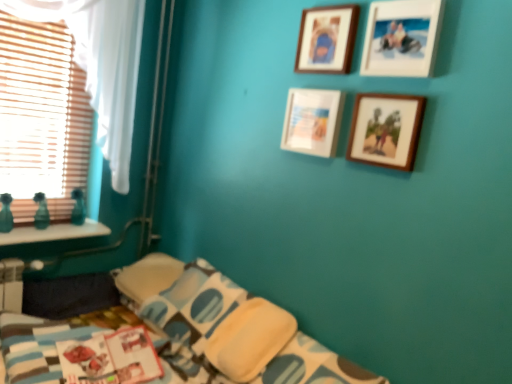
Question: Is wooden photo frame at upper right, the 1th picture frame positioned from the bottom, placed right next to wooden photo frame at upper right, the second picture frame viewed from the top?

Choices:
 (A) yes
 (B) no

Answer: (B)

Question: Can you confirm if wooden photo frame at upper right, the 1th picture frame positioned from the bottom, is positioned to the left of wooden photo frame at upper right, which is counted as the third picture frame, starting from the bottom?

Choices:
 (A) no
 (B) yes

Answer: (B)

Question: Is wooden photo frame at upper right, the 1th picture frame positioned from the bottom, aimed at wooden photo frame at upper right, which is counted as the third picture frame, starting from the bottom?

Choices:
 (A) no
 (B) yes

Answer: (A)

Question: Can you confirm if wooden photo frame at upper right, the 1th picture frame positioned from the bottom, is wider than wooden photo frame at upper right, the second picture frame viewed from the top?

Choices:
 (A) yes
 (B) no

Answer: (B)

Question: From the image's perspective, does wooden photo frame at upper right, the 1th picture frame positioned from the bottom, appear lower than wooden photo frame at upper right, the second picture frame viewed from the top?

Choices:
 (A) yes
 (B) no

Answer: (A)

Question: Does point (378, 165) appear closer or farther from the camera than point (330, 44)?

Choices:
 (A) closer
 (B) farther

Answer: (A)

Question: Choose the correct answer: Is wooden photo frame at upper right, which ranks as the 4th picture frame in top-to-bottom order, inside wooden picture frame at upper center, which is the first picture frame from top to bottom, or outside it?

Choices:
 (A) outside
 (B) inside

Answer: (A)

Question: From the image's perspective, is wooden photo frame at upper right, the 1th picture frame positioned from the bottom, above or below wooden picture frame at upper center, which is counted as the fourth picture frame, starting from the bottom?

Choices:
 (A) below
 (B) above

Answer: (A)

Question: In terms of height, does wooden photo frame at upper right, the 1th picture frame positioned from the bottom, look taller or shorter compared to wooden picture frame at upper center, which is the first picture frame from top to bottom?

Choices:
 (A) short
 (B) tall

Answer: (A)

Question: From the image's perspective, is wooden picture frame at upper center, which is counted as the fourth picture frame, starting from the bottom, above or below wooden photo frame at upper right, the 1th picture frame positioned from the bottom?

Choices:
 (A) above
 (B) below

Answer: (A)

Question: Considering their positions, is wooden picture frame at upper center, which is the first picture frame from top to bottom, located in front of or behind wooden photo frame at upper right, the 1th picture frame positioned from the bottom?

Choices:
 (A) front
 (B) behind

Answer: (B)

Question: Is wooden picture frame at upper center, which is counted as the fourth picture frame, starting from the bottom, wider or thinner than wooden photo frame at upper right, which ranks as the 4th picture frame in top-to-bottom order?

Choices:
 (A) wide
 (B) thin

Answer: (A)

Question: Is point (310, 43) positioned closer to the camera than point (384, 134)?

Choices:
 (A) closer
 (B) farther

Answer: (B)

Question: Considering the positions of point (320, 145) and point (24, 231), is point (320, 145) closer or farther from the camera than point (24, 231)?

Choices:
 (A) farther
 (B) closer

Answer: (B)

Question: In terms of width, does white matte picture frame at center, which is counted as the 3th picture frame, starting from the top, look wider or thinner when compared to green glass vases at left?

Choices:
 (A) wide
 (B) thin

Answer: (B)